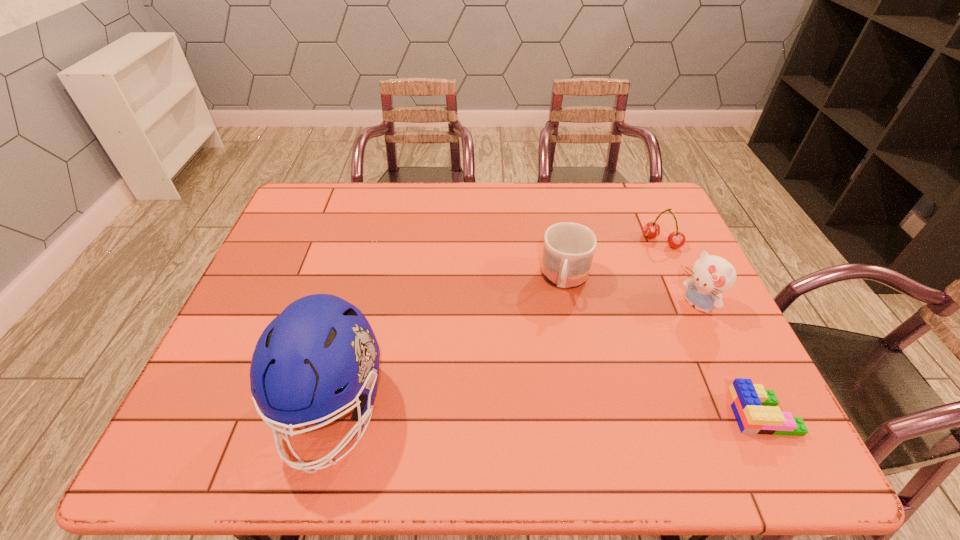
Locate an element on the screen. The image size is (960, 540). vacant space situated on the side with the handle of the mug is located at coordinates (561, 318).

Where is `free region located on the side with the handle of the mug`? free region located on the side with the handle of the mug is located at coordinates (550, 373).

Locate an element on the screen. The height and width of the screenshot is (540, 960). free space located on the side with the handle of the mug is located at coordinates (557, 339).

Locate an element on the screen. vacant space situated on the front-facing side of the fourth shortest object is located at coordinates (659, 334).

This screenshot has width=960, height=540. I want to click on vacant space located on the front-facing side of the fourth shortest object, so click(x=635, y=352).

You are a GUI agent. You are given a task and a screenshot of the screen. Output one action in this format:
    pyautogui.click(x=<x>, y=<y>)
    Task: Click on the vacant space located 0.120m on the front-facing side of the fourth shortest object
    This screenshot has height=540, width=960.
    Given the screenshot: What is the action you would take?
    pyautogui.click(x=654, y=338)

You are a GUI agent. You are given a task and a screenshot of the screen. Output one action in this format:
    pyautogui.click(x=<x>, y=<y>)
    Task: Click on the football helmet situated at the near edge
    This screenshot has height=540, width=960.
    Given the screenshot: What is the action you would take?
    pyautogui.click(x=320, y=355)

Locate an element on the screen. This screenshot has height=540, width=960. Lego that is at the near edge is located at coordinates (755, 408).

Image resolution: width=960 pixels, height=540 pixels. I want to click on Lego at the right edge, so click(x=755, y=408).

At what (x,y) coordinates should I click in order to perform the action: click on cherry located at the right edge. Please return your answer as a coordinate pair (x, y). Image resolution: width=960 pixels, height=540 pixels. Looking at the image, I should click on (651, 230).